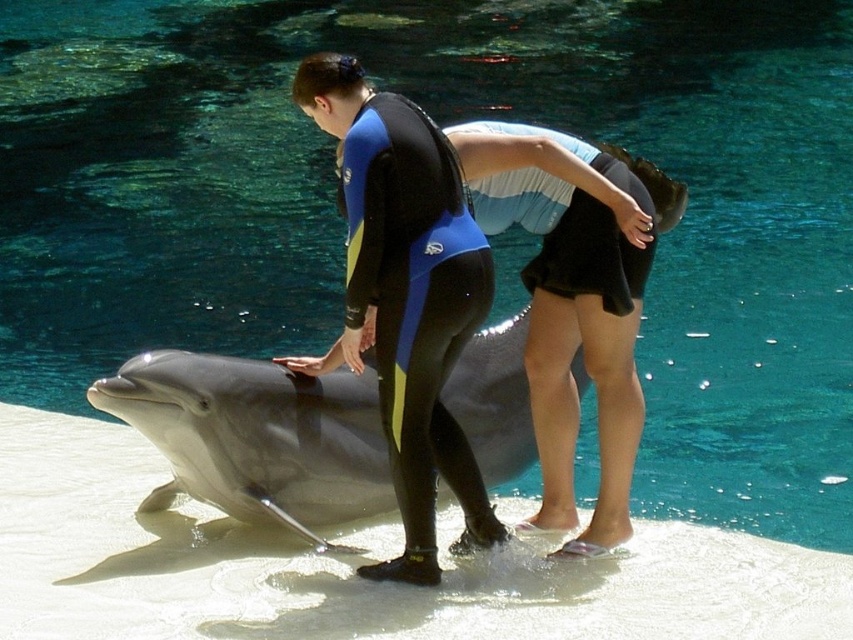
Can you confirm if smooth gray dolphin at center is wider than black neoprene wetsuit at center?

Indeed, smooth gray dolphin at center has a greater width compared to black neoprene wetsuit at center.

Who is more forward, (376,465) or (395,234)?

Point (395,234) is more forward.

Is point (508, 472) positioned before point (387, 416)?

No, it is behind (387, 416).

This screenshot has width=853, height=640. Find the location of `smooth gray dolphin at center`. smooth gray dolphin at center is located at coordinates (256, 436).